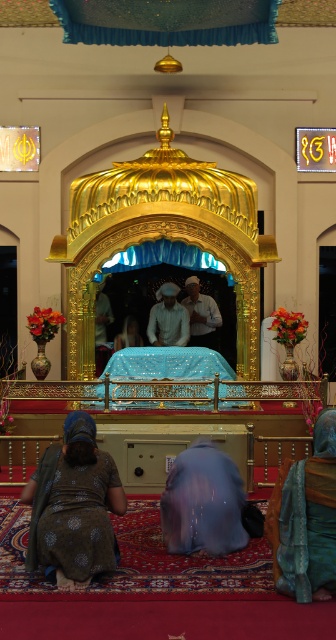
Question: Does dark brown fabric at lower left have a larger size compared to white cotton robe at center?

Choices:
 (A) no
 (B) yes

Answer: (B)

Question: Estimate the real-world distances between objects in this image. Which object is farther from the white cotton robe at center?

Choices:
 (A) dark brown fabric at lower left
 (B) white matte robe at center

Answer: (A)

Question: Which object appears farthest from the camera in this image?

Choices:
 (A) white cotton robe at center
 (B) white matte robe at center
 (C) teal fabric robe at lower right
 (D) dark brown fabric at lower left

Answer: (A)

Question: Is dark brown fabric at lower left below white matte robe at center?

Choices:
 (A) no
 (B) yes

Answer: (B)

Question: Does blue satin robe at center appear under white matte robe at center?

Choices:
 (A) yes
 (B) no

Answer: (A)

Question: Which of the following is the closest to the observer?

Choices:
 (A) [x=87, y=522]
 (B) [x=296, y=492]
 (C) [x=194, y=440]

Answer: (B)